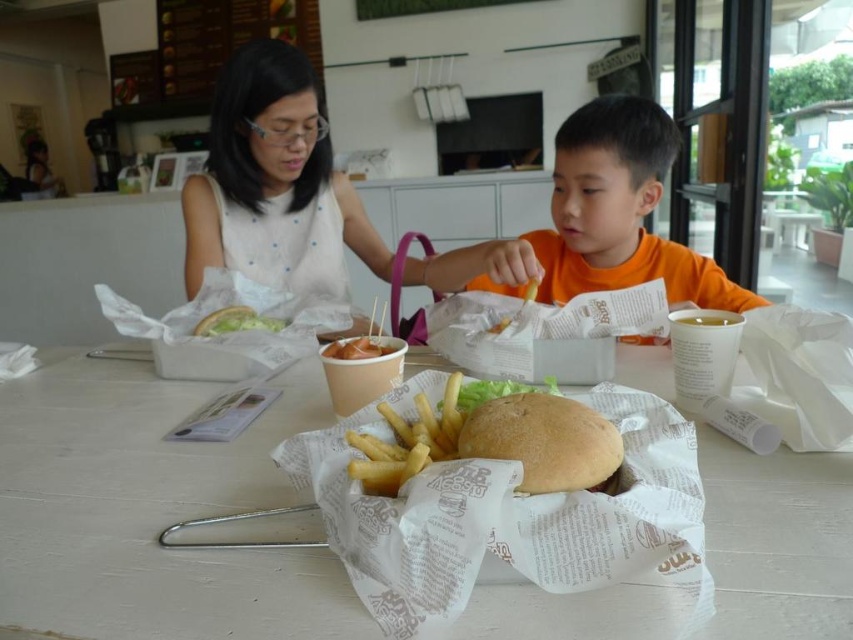
You are a customer at this fast food restaurant and you want to reach the yellowish matte chicken at center without touching the orange matte shirt at center. Is this possible?

The orange matte shirt at center is above the yellowish matte chicken at center, so you can reach the yellowish matte chicken at center by moving under the shirt or around it to avoid contact.